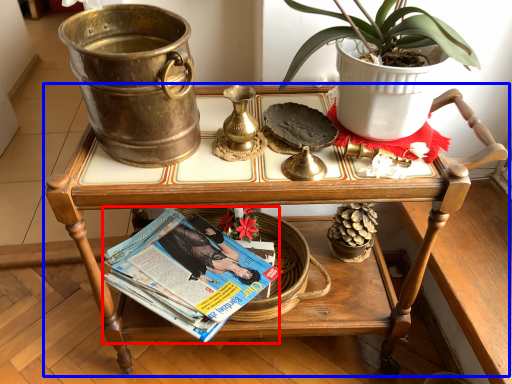
Question: Among these objects, which one is farthest to the camera, magazine (highlighted by a red box) or table (highlighted by a blue box)?

Choices:
 (A) magazine
 (B) table

Answer: (A)